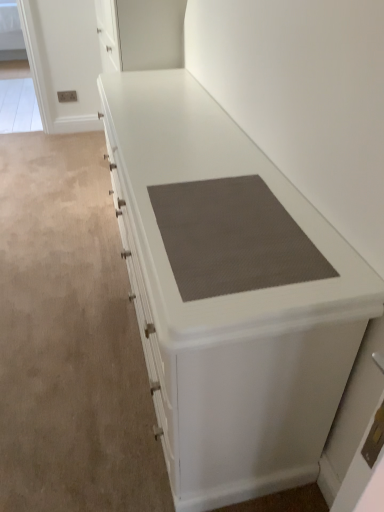
Measure the distance between point (362, 269) and camera.

35.00 inches.

This screenshot has height=512, width=384. Describe the element at coordinates (229, 307) in the screenshot. I see `white textured cabinet at center` at that location.

This screenshot has width=384, height=512. Find the location of `white textured cabinet at center`. white textured cabinet at center is located at coordinates (229, 307).

This screenshot has width=384, height=512. Identify the location of white textured cabinet at center. (229, 307).